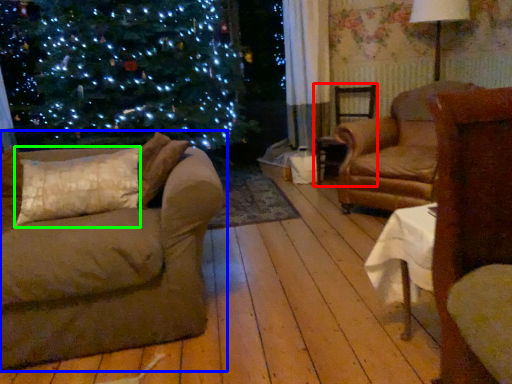
Question: Which object is positioned farthest from chair (highlighted by a red box)? Select from studio couch (highlighted by a blue box) and pillow (highlighted by a green box).

Choices:
 (A) studio couch
 (B) pillow

Answer: (A)